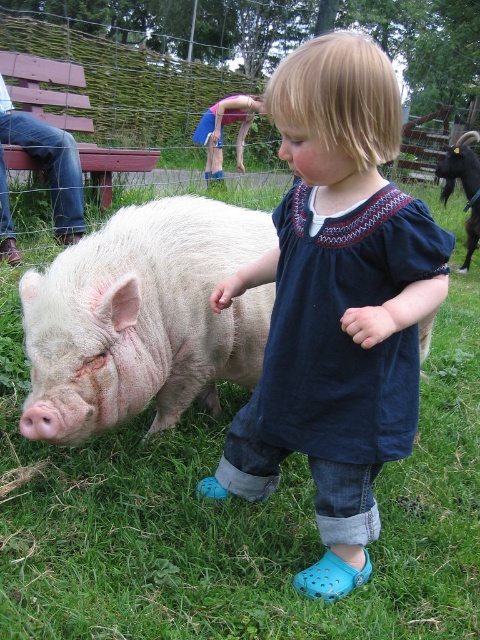
Which is in front, point (302, 460) or point (108, 224)?

Positioned in front is point (108, 224).

Which is above, green grass at center or white furry pig at center?

Positioned higher is white furry pig at center.

Image resolution: width=480 pixels, height=640 pixels. I want to click on green grass at center, so click(236, 518).

What are the coordinates of `green grass at center` in the screenshot? It's located at (236, 518).

Can you confirm if blue denim dress at center is positioned to the left of blue denim shorts at center?

Incorrect, blue denim dress at center is not on the left side of blue denim shorts at center.

Is point (384, 138) more distant than point (222, 163)?

No, (384, 138) is closer to viewer.

Locate an element on the screen. This screenshot has width=480, height=640. blue denim dress at center is located at coordinates (336, 304).

In the scene shown: Can you confirm if white furry pig at center is shorter than blue denim shorts at center?

Indeed, white furry pig at center has a lesser height compared to blue denim shorts at center.

Image resolution: width=480 pixels, height=640 pixels. Describe the element at coordinates (143, 317) in the screenshot. I see `white furry pig at center` at that location.

Identify the location of white furry pig at center. (143, 317).